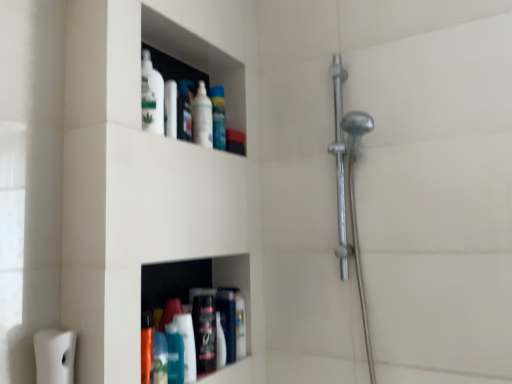
Image resolution: width=512 pixels, height=384 pixels. What do you see at coordinates (54, 356) in the screenshot?
I see `white matte toilet paper at lower left` at bounding box center [54, 356].

What is the approximate height of matte black bottle at lower center, the second toiletry in the top-to-bottom sequence?

8.58 inches.

This screenshot has height=384, width=512. What do you see at coordinates (344, 154) in the screenshot? I see `polished chrome shower at right` at bounding box center [344, 154].

Where is `polished chrome shower at right`? This screenshot has height=384, width=512. polished chrome shower at right is located at coordinates (344, 154).

What are the coordinates of `teal glossy bottle at lower center, which is the 1th cleaning product from bottom to top` in the screenshot? It's located at (187, 345).

I want to click on white glossy bottle at upper center, placed as the first mouthwash when sorted from back to front, so click(202, 117).

Can we say teal glossy bottle at lower center, the second cleaning product in the right-to-left sequence, lies outside white glossy bottle at upper center, arranged as the first mouthwash when viewed from the right?

teal glossy bottle at lower center, the second cleaning product in the right-to-left sequence, lies outside white glossy bottle at upper center, arranged as the first mouthwash when viewed from the right,'s area.

Is teal glossy bottle at lower center, marked as the second cleaning product in a back-to-front arrangement, turned away from white glossy bottle at upper center, the 2th mouthwash viewed from the front?

No.

Does point (190, 348) come closer to viewer compared to point (209, 100)?

Yes, point (190, 348) is closer to viewer.

From the image's perspective, between teal glossy bottle at lower center, which is the 1th cleaning product from bottom to top, and white glossy bottle at upper center, the 2th mouthwash viewed from the front, who is located below?

teal glossy bottle at lower center, which is the 1th cleaning product from bottom to top, from the image's perspective.

From their relative heights in the image, would you say translucent plastic spray bottle at upper center, which is the 2th cleaning product from front to back, is taller or shorter than blue glossy mouthwash at lower center, positioned as the first mouthwash in bottom-to-top order?

Clearly, translucent plastic spray bottle at upper center, which is the 2th cleaning product from front to back, is taller compared to blue glossy mouthwash at lower center, positioned as the first mouthwash in bottom-to-top order.

From the picture: What's the angular difference between translucent plastic spray bottle at upper center, the 2th cleaning product viewed from the left, and blue glossy mouthwash at lower center, arranged as the first mouthwash when viewed from the front,'s facing directions?

The facing directions of translucent plastic spray bottle at upper center, the 2th cleaning product viewed from the left, and blue glossy mouthwash at lower center, arranged as the first mouthwash when viewed from the front, are 29.5 degrees apart.

Between point (215, 148) and point (172, 366), which one is positioned behind?

The point (215, 148) is more distant.

From the image's perspective, relative to blue glossy mouthwash at lower center, the 1th mouthwash when ordered from left to right, is translucent plastic spray bottle at upper center, the 2th cleaning product viewed from the left, above or below?

translucent plastic spray bottle at upper center, the 2th cleaning product viewed from the left, is above blue glossy mouthwash at lower center, the 1th mouthwash when ordered from left to right.

From a real-world perspective, is white glossy bottle at upper center, arranged as the first mouthwash when viewed from the right, positioned under white matte toilet paper at lower left based on gravity?

Actually, white glossy bottle at upper center, arranged as the first mouthwash when viewed from the right, is physically above white matte toilet paper at lower left in the real world.

Is there a large distance between white glossy bottle at upper center, the 2th mouthwash when ordered from left to right, and white matte toilet paper at lower left?

They are positioned close to each other.

Locate an element on the screen. toilet paper in front of the white glossy bottle at upper center, the 2th mouthwash viewed from the front is located at coordinates (54, 356).

Is white glossy bottle at upper center, the 2th mouthwash viewed from the front, not close to matte plastic container at upper center, the 2th toiletry from the bottom?

They are positioned close to each other.

Considering the positions of points (198, 95) and (189, 85), is point (198, 95) farther from camera compared to point (189, 85)?

No, (198, 95) is in front of (189, 85).

Which is more to the right, white glossy bottle at upper center, the 2th mouthwash viewed from the front, or matte plastic container at upper center, placed as the 1th toiletry when sorted from left to right?

Positioned to the right is white glossy bottle at upper center, the 2th mouthwash viewed from the front.

Which object is further away from the camera, blue glossy mouthwash at lower center, marked as the second mouthwash in a top-to-bottom arrangement, or white matte toilet paper at lower left?

blue glossy mouthwash at lower center, marked as the second mouthwash in a top-to-bottom arrangement, is behind.

Is blue glossy mouthwash at lower center, marked as the second mouthwash in a back-to-front arrangement, turned away from white matte toilet paper at lower left?

That's not correct — blue glossy mouthwash at lower center, marked as the second mouthwash in a back-to-front arrangement, is not looking away from white matte toilet paper at lower left.

Can you see blue glossy mouthwash at lower center, placed as the 2th mouthwash when sorted from right to left, touching white matte toilet paper at lower left?

blue glossy mouthwash at lower center, placed as the 2th mouthwash when sorted from right to left, is not next to white matte toilet paper at lower left, and they're not touching.

You are a GUI agent. You are given a task and a screenshot of the screen. Output one action in this format:
    pyautogui.click(x=<x>, y=<y>)
    Task: Click on the toilet paper on the left of blue glossy mouthwash at lower center, placed as the 2th mouthwash when sorted from right to left
    The width and height of the screenshot is (512, 384).
    Given the screenshot: What is the action you would take?
    pyautogui.click(x=54, y=356)

From a real-world perspective, is matte black bottle at lower center, which is the 1th toiletry in right-to-left order, above or below blue glossy mouthwash at lower center, placed as the 2th mouthwash when sorted from right to left?

Clearly, from a real-world perspective, matte black bottle at lower center, which is the 1th toiletry in right-to-left order, is above blue glossy mouthwash at lower center, placed as the 2th mouthwash when sorted from right to left.

Can you confirm if matte black bottle at lower center, which is the 1th toiletry in right-to-left order, is taller than blue glossy mouthwash at lower center, the 1th mouthwash when ordered from left to right?

Yes, matte black bottle at lower center, which is the 1th toiletry in right-to-left order, is taller than blue glossy mouthwash at lower center, the 1th mouthwash when ordered from left to right.

Locate an element on the screen. the 2nd toiletry behind the blue glossy mouthwash at lower center, positioned as the first mouthwash in bottom-to-top order is located at coordinates (227, 319).

Does point (222, 95) lie in front of point (187, 333)?

No, it is behind (187, 333).

Visually, is translucent plastic spray bottle at upper center, which appears as the 1th cleaning product when viewed from the back, positioned to the left or to the right of teal glossy bottle at lower center, which is the 1th cleaning product from bottom to top?

translucent plastic spray bottle at upper center, which appears as the 1th cleaning product when viewed from the back, is to the right of teal glossy bottle at lower center, which is the 1th cleaning product from bottom to top.

The width and height of the screenshot is (512, 384). What are the coordinates of `cleaning product below the translucent plastic spray bottle at upper center, which appears as the 1th cleaning product when viewed from the back (from a real-world perspective)` in the screenshot? It's located at (187, 345).

Can we say translucent plastic spray bottle at upper center, the second cleaning product positioned from the bottom, lies outside teal glossy bottle at lower center, marked as the second cleaning product in a back-to-front arrangement?

Absolutely, translucent plastic spray bottle at upper center, the second cleaning product positioned from the bottom, is external to teal glossy bottle at lower center, marked as the second cleaning product in a back-to-front arrangement.

This screenshot has width=512, height=384. What are the coordinates of `mouthwash that is above the teal glossy bottle at lower center, the first cleaning product from the left (from a real-world perspective)` in the screenshot? It's located at (202, 117).

Locate an element on the screen. mouthwash below the translucent plastic spray bottle at upper center, marked as the first cleaning product in a top-to-bottom arrangement (from the image's perspective) is located at coordinates (175, 354).

Looking at the image, which one is located further to teal glossy bottle at lower center, which is the 1th cleaning product from bottom to top, blue glossy mouthwash at lower center, the 1th mouthwash when ordered from left to right, or matte plastic container at upper center, the 2th toiletry from the bottom?

matte plastic container at upper center, the 2th toiletry from the bottom.

Which object lies nearer to the anchor point teal glossy bottle at lower center, which is the 1th cleaning product from bottom to top, blue glossy mouthwash at lower center, positioned as the first mouthwash in bottom-to-top order, or white matte toilet paper at lower left?

Based on the image, blue glossy mouthwash at lower center, positioned as the first mouthwash in bottom-to-top order, appears to be nearer to teal glossy bottle at lower center, which is the 1th cleaning product from bottom to top.

In the scene shown: Estimate the real-world distances between objects in this image. Which object is closer to white glossy bottle at upper center, which is the second mouthwash in bottom-to-top order, blue glossy mouthwash at lower center, marked as the second mouthwash in a back-to-front arrangement, or matte plastic container at upper center, the second toiletry viewed from the right?

matte plastic container at upper center, the second toiletry viewed from the right, is positioned closer to the anchor white glossy bottle at upper center, which is the second mouthwash in bottom-to-top order.

Which object lies nearer to the anchor point polished chrome shower at right, translucent plastic spray bottle at upper center, which is the 1th cleaning product in right-to-left order, or matte black bottle at lower center, the second toiletry in the top-to-bottom sequence?

Among the two, translucent plastic spray bottle at upper center, which is the 1th cleaning product in right-to-left order, is located nearer to polished chrome shower at right.

Estimate the real-world distances between objects in this image. Which object is further from blue glossy mouthwash at lower center, marked as the second mouthwash in a top-to-bottom arrangement, white matte toilet paper at lower left or teal glossy bottle at lower center, marked as the second cleaning product in a back-to-front arrangement?

white matte toilet paper at lower left is positioned further to the anchor blue glossy mouthwash at lower center, marked as the second mouthwash in a top-to-bottom arrangement.

Looking at the image, which one is located closer to matte black bottle at lower center, marked as the first toiletry in a bottom-to-top arrangement, translucent plastic spray bottle at upper center, marked as the first cleaning product in a top-to-bottom arrangement, or white glossy bottle at upper center, which is the second mouthwash in bottom-to-top order?

white glossy bottle at upper center, which is the second mouthwash in bottom-to-top order.

From the image, which object appears to be nearer to blue glossy mouthwash at lower center, marked as the second mouthwash in a top-to-bottom arrangement, matte black bottle at lower center, marked as the 2th toiletry in a left-to-right arrangement, or matte plastic container at upper center, which appears as the 1th toiletry when viewed from the top?

matte black bottle at lower center, marked as the 2th toiletry in a left-to-right arrangement.

Estimate the real-world distances between objects in this image. Which object is closer to blue glossy mouthwash at lower center, placed as the 2th mouthwash when sorted from right to left, matte black bottle at lower center, which is the 1th toiletry in right-to-left order, or polished chrome shower at right?

Among the two, matte black bottle at lower center, which is the 1th toiletry in right-to-left order, is located nearer to blue glossy mouthwash at lower center, placed as the 2th mouthwash when sorted from right to left.

Identify the location of cleaning product that lies between matte plastic container at upper center, the second toiletry viewed from the right, and matte black bottle at lower center, which is the 1th toiletry in right-to-left order, from top to bottom. (187, 345).

Identify the location of cleaning product between white glossy bottle at upper center, which is the second mouthwash in bottom-to-top order, and teal glossy bottle at lower center, marked as the second cleaning product in a back-to-front arrangement, in the vertical direction. (218, 117).

Locate an element on the screen. The image size is (512, 384). toiletry between translucent plastic spray bottle at upper center, the 2th cleaning product viewed from the left, and white matte toilet paper at lower left from top to bottom is located at coordinates (184, 111).

You are a GUI agent. You are given a task and a screenshot of the screen. Output one action in this format:
    pyautogui.click(x=<x>, y=<y>)
    Task: Click on the toiletry between white glossy bottle at upper center, the 2th mouthwash viewed from the front, and matte black bottle at lower center, marked as the first toiletry in a bottom-to-top arrangement, in the vertical direction
    The height and width of the screenshot is (384, 512).
    Given the screenshot: What is the action you would take?
    pyautogui.click(x=184, y=111)